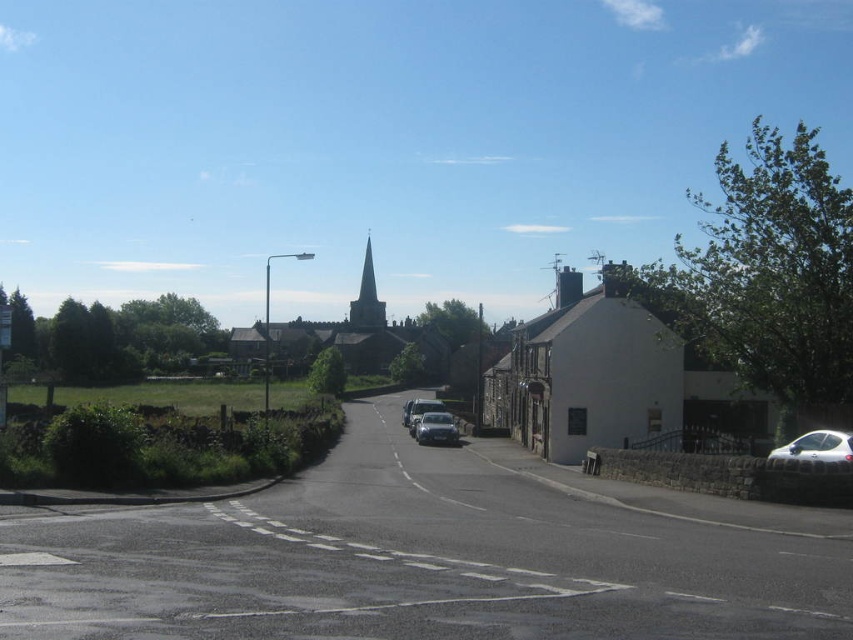
You are driving along the rural road and see the white stone spire at center and the white plastic street sign at left. Which object is located higher up in the image?

The white stone spire at center is positioned over the white plastic street sign at left, meaning it is higher up in the image.

You are driving a car and want to park behind the white stone church at center. Can you park the shiny silver car at center there?

The white stone church at center is in front of the shiny silver car at center, so the shiny silver car at center is already parked behind the white stone church at center.

Consider the image. You are a photographer trying to capture both the white stone church at center and the shiny silver car at center in a single frame. Based on their positions, which object should you focus on first to ensure both are in the shot?

The white stone church at center is above the shiny silver car at center, so you should focus on the shiny silver car at center first to ensure both are in the shot.